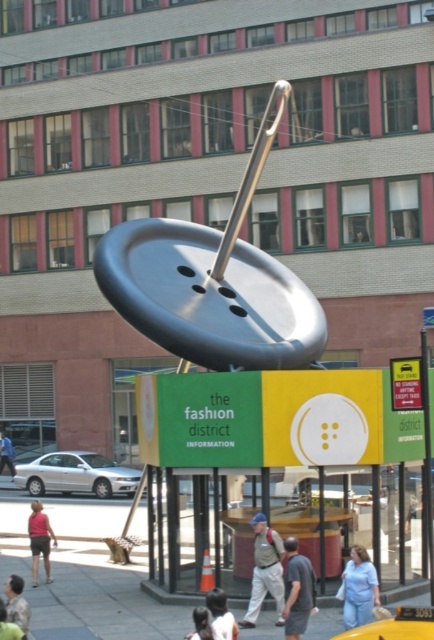
You are a tailor carrying a gray fabric shirt at lower center and need to place it on a hanger located at the brushed metal pole at right. Can you reach the pole without moving the shirt? Please provide your answer based on the distance between them.

The distance between the gray fabric shirt at lower center and the brushed metal pole at right is 8.41 feet. Since the tailor can extend their arm approximately 2.5 feet, they cannot reach the pole without moving the shirt.

You are a tailor looking to display two shirts in your store window. You have a gray fabric shirt at lower center and a matte pink shirt at lower left. Which shirt should you place higher to ensure both are visible to passersby?

The gray fabric shirt at lower center has a lesser height compared to the matte pink shirt at lower left, so placing the taller matte pink shirt at lower left higher up will help both shirts remain visible to passersby.

You are a tailor standing in front of the sculpture and need to hang a gray fabric shirt at lower center on a hanger. The hanger requires a pole taller than the shirt. Can you use the brushed metal pole at right for this purpose?

The gray fabric shirt at lower center is not as tall as the brushed metal pole at right, so the brushed metal pole at right is tall enough to accommodate the shirt. Therefore, you can use the brushed metal pole at right to hang the gray fabric shirt at lower center.